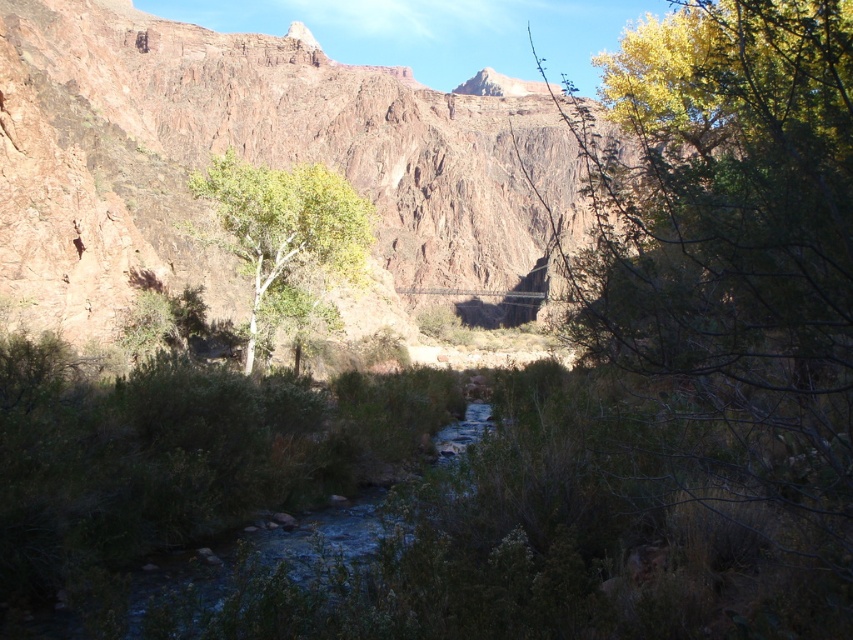
You are a hiker standing at the edge of the canyon looking at the rustic rock mountain at center and the green leafy tree at center. Which object is positioned to the left?

The rustic rock mountain at center is positioned to the left of the green leafy tree at center according to the description.

You are standing at the edge of the canyon and want to reach a specific point marked at coordinates point (351, 305). If your maximum comfortable walking distance is 150 meters, can you comfortably walk to that point without needing a guide?

The point (351, 305) is 154.66 meters away from the viewer. Since this exceeds your maximum comfortable walking distance of 150 meters, you would need assistance or a guide to reach it comfortably.

You are hiking in the canyon and want to take a photo of the rustic rock mountain at center and the green leafy tree at center. Which object should you focus on first if you want to capture both in the same frame without moving your camera?

The rustic rock mountain at center is positioned over the green leafy tree at center, so you should focus on the green leafy tree at center first since it is closer to the camera, allowing both to be in the same frame without moving the camera.